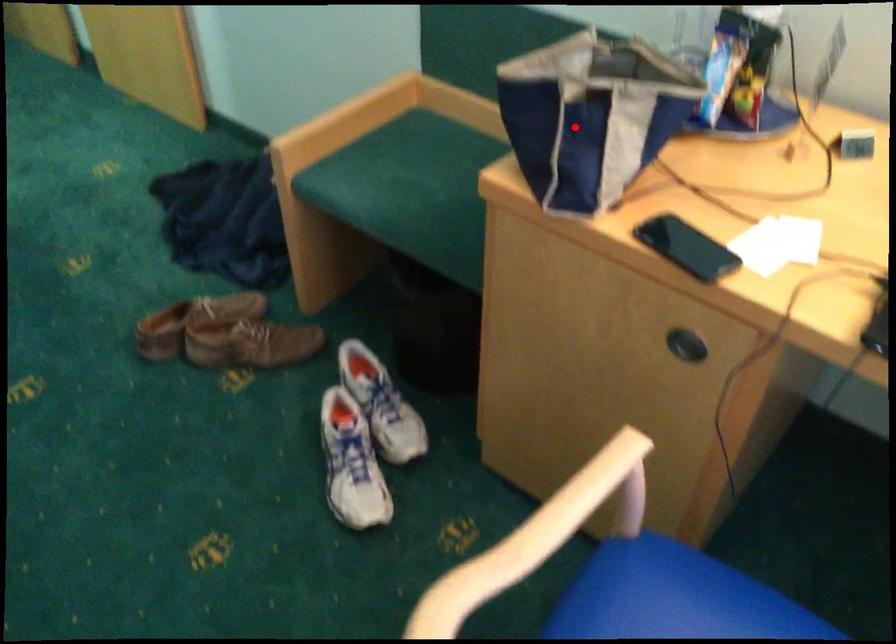
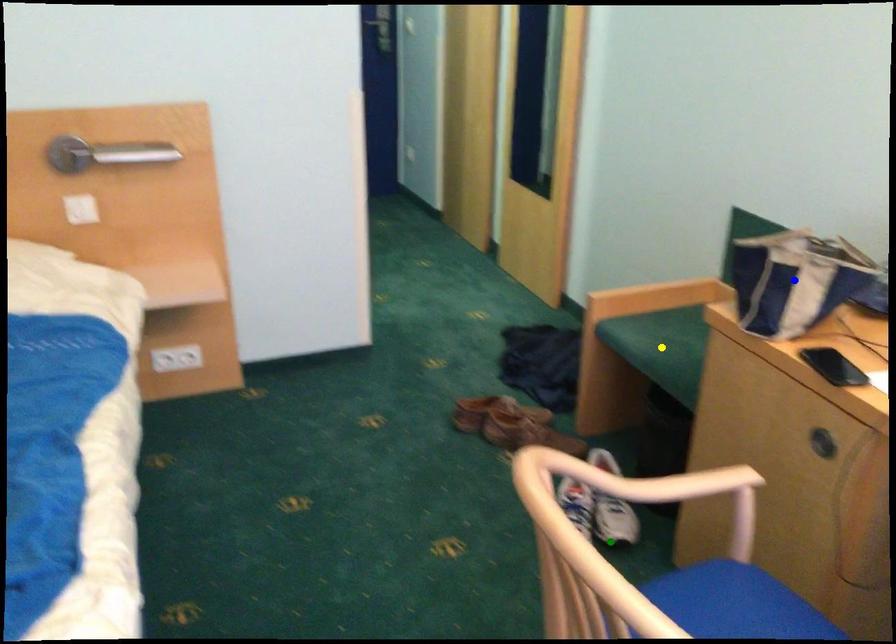
Question: I am providing you with two images of the same scene from different viewpoints. A red point is marked on the first image. You are given multiple points on the second image. In image 2, which mark is for the same physical point as the one in image 1?

Choices:
 (A) blue point
 (B) yellow point
 (C) green point

Answer: (A)